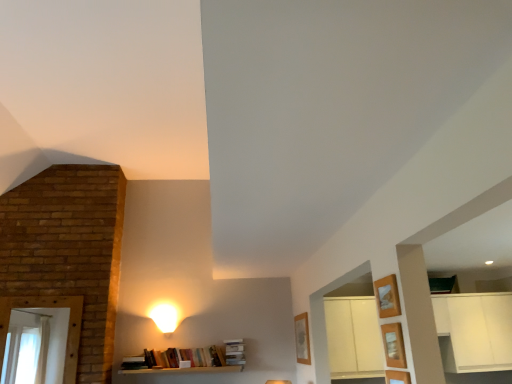
Question: Is wooden shelf at lower right, which is counted as the second shelf, starting from the top, positioned behind matte white lampshade at upper center?

Choices:
 (A) no
 (B) yes

Answer: (A)

Question: Is wooden shelf at lower right, which is counted as the second shelf, starting from the top, at the left side of matte white lampshade at upper center?

Choices:
 (A) no
 (B) yes

Answer: (A)

Question: From a real-world perspective, is wooden shelf at lower right, which is the 2th shelf in bottom-to-top order, over matte white lampshade at upper center?

Choices:
 (A) yes
 (B) no

Answer: (B)

Question: From the image's perspective, is wooden shelf at lower right, which is counted as the second shelf, starting from the top, located beneath matte white lampshade at upper center?

Choices:
 (A) no
 (B) yes

Answer: (A)

Question: Considering the relative sizes of wooden shelf at lower right, which is counted as the second shelf, starting from the top, and matte white lampshade at upper center in the image provided, is wooden shelf at lower right, which is counted as the second shelf, starting from the top, taller than matte white lampshade at upper center?

Choices:
 (A) no
 (B) yes

Answer: (A)

Question: Is the surface of wooden shelf at lower right, which is the 2th shelf in bottom-to-top order, in direct contact with matte white lampshade at upper center?

Choices:
 (A) no
 (B) yes

Answer: (A)

Question: Considering the relative sizes of wooden shelf at lower right, which is the 2th shelf in bottom-to-top order, and wooden shelf at lower right, placed as the 3th shelf when sorted from top to bottom, in the image provided, is wooden shelf at lower right, which is the 2th shelf in bottom-to-top order, shorter than wooden shelf at lower right, placed as the 3th shelf when sorted from top to bottom,?

Choices:
 (A) yes
 (B) no

Answer: (B)

Question: Is wooden shelf at lower right, which is the 2th shelf in bottom-to-top order, surrounding wooden shelf at lower right, the first shelf positioned from the bottom?

Choices:
 (A) no
 (B) yes

Answer: (A)

Question: Can you see wooden shelf at lower right, which is the 2th shelf in bottom-to-top order, touching wooden shelf at lower right, the first shelf positioned from the bottom?

Choices:
 (A) no
 (B) yes

Answer: (B)

Question: Is wooden shelf at lower right, which is the 2th shelf in bottom-to-top order, not inside wooden shelf at lower right, placed as the 3th shelf when sorted from top to bottom?

Choices:
 (A) yes
 (B) no

Answer: (A)

Question: Does wooden shelf at lower right, which is counted as the second shelf, starting from the top, have a larger size compared to wooden shelf at lower right, the first shelf positioned from the bottom?

Choices:
 (A) no
 (B) yes

Answer: (A)

Question: Does wooden shelf at lower right, which is the 2th shelf in bottom-to-top order, have a lesser width compared to wooden shelf at lower right, placed as the 3th shelf when sorted from top to bottom?

Choices:
 (A) yes
 (B) no

Answer: (B)

Question: Is wooden shelf at lower right, placed as the 3th shelf when sorted from top to bottom, directly adjacent to wooden shelf at lower right, which is the 2th shelf in bottom-to-top order?

Choices:
 (A) yes
 (B) no

Answer: (A)